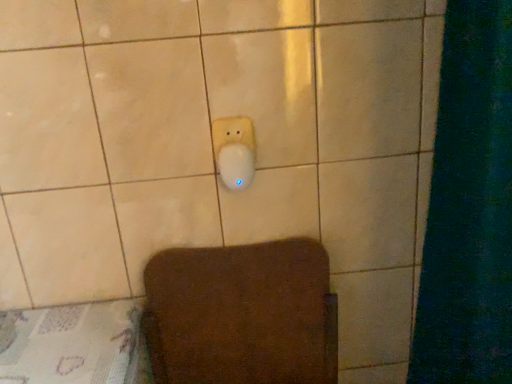
This screenshot has height=384, width=512. Identify the location of white plastic light switch at center. (234, 151).

What do you see at coordinates (234, 151) in the screenshot?
I see `white plastic light switch at center` at bounding box center [234, 151].

The image size is (512, 384). Identify the location of white plastic light switch at center. (234, 151).